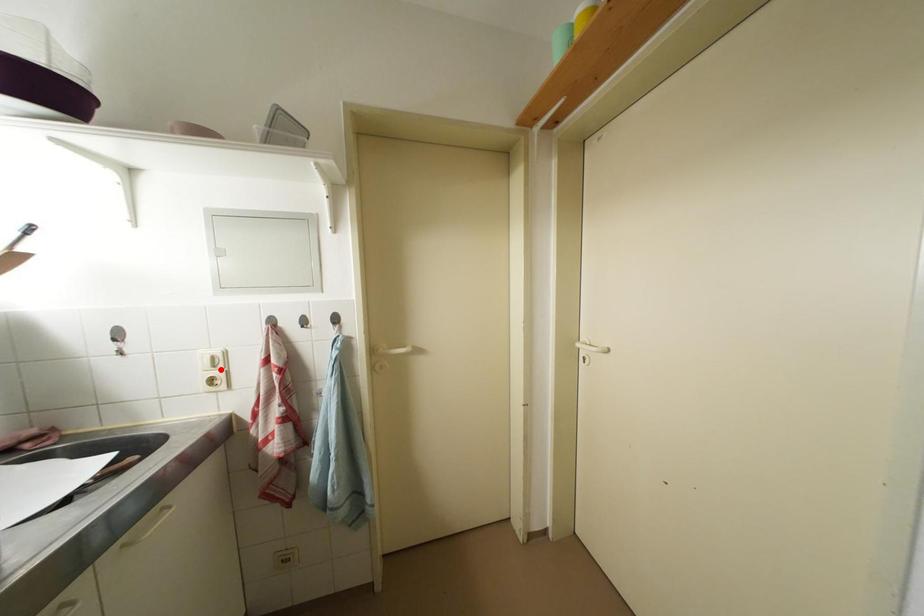
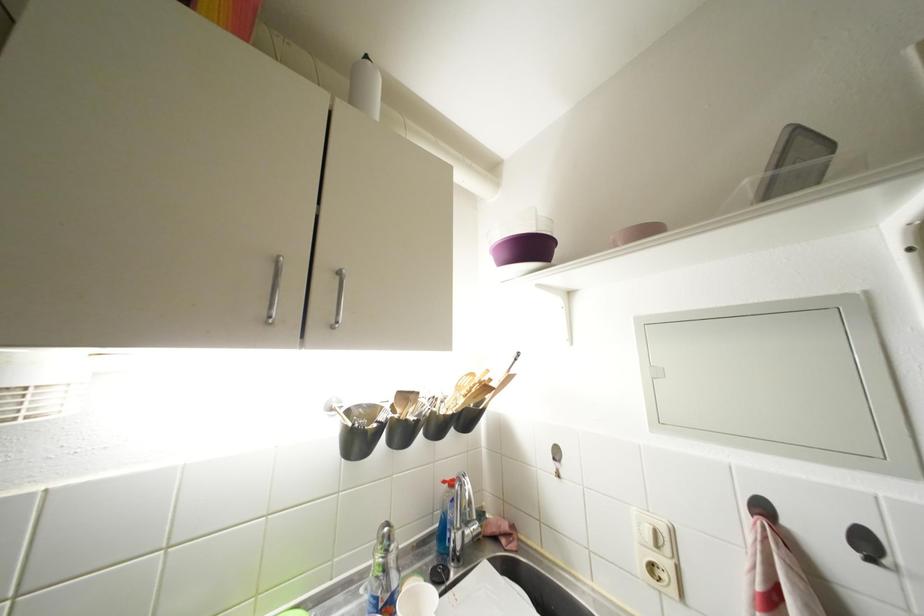
In the second image, find the point that corresponds to the highlighted location in the first image.

(663, 549)